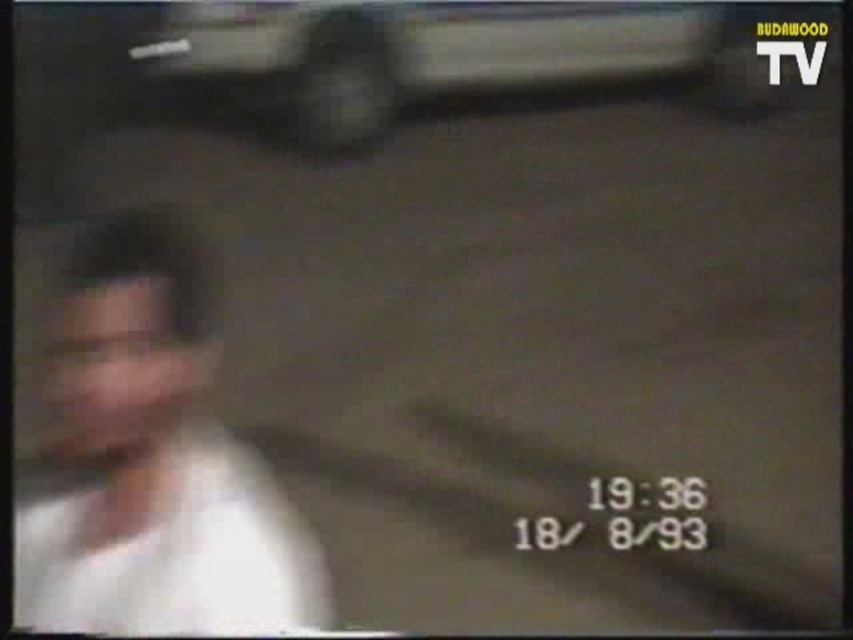
You are analyzing a surveillance video from 1993 and notice two points in the frame. The first point is at coordinates point (19, 538) and the second is at point (701, 26). Which point is closer to the camera?

Point (19, 538) is closer to the camera than point (701, 26) according to the footage.

You are a security guard monitoring the footage from BUDAWOOD TV. You notice a person wearing a white matte shirt at left and a metallic silver car at upper center in the frame. Based on the distance between them, can you determine if the person is close enough to reach the car within 10 seconds if they start walking towards it immediately?

The white matte shirt at left is 16.01 inches from the metallic silver car at upper center. Assuming an average walking speed of 3 feet per second, the distance of 16.01 inches is approximately 1.33 feet. The person could reach the metallic silver car at upper center in about 0.44 seconds, which is well within the 10 seconds timeframe.